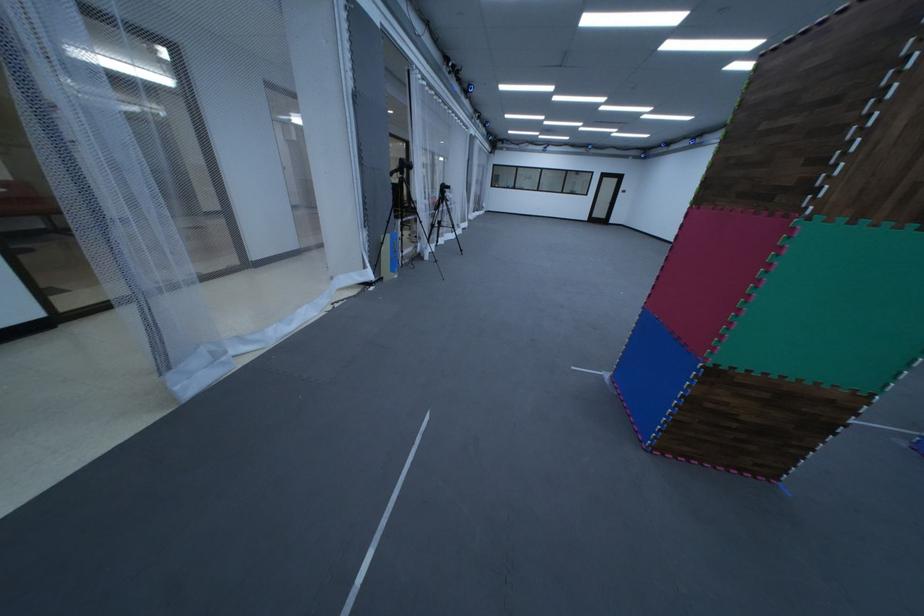
The height and width of the screenshot is (616, 924). I want to click on black tripod, so click(x=404, y=209).